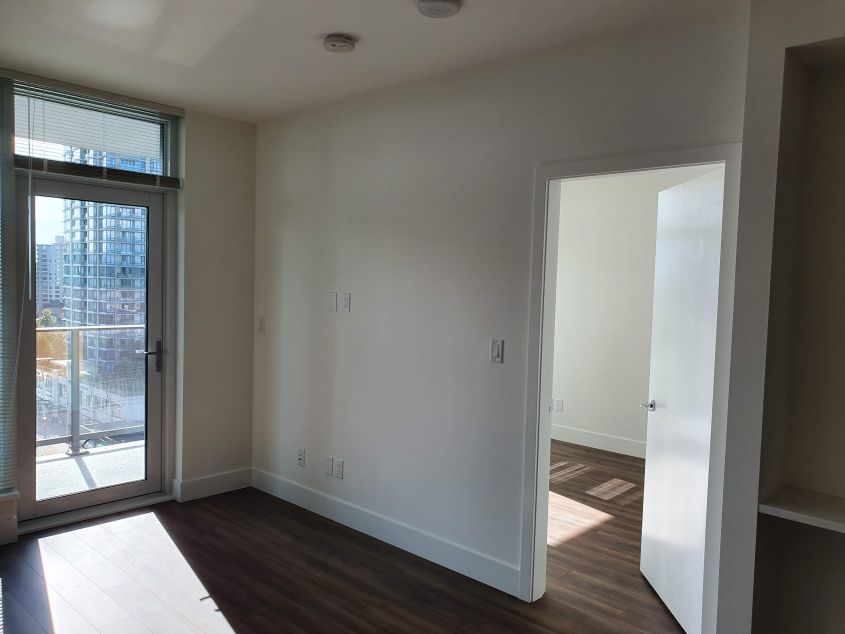
You are a GUI agent. You are given a task and a screenshot of the screen. Output one action in this format:
    pyautogui.click(x=<x>, y=<y>)
    Task: Click on the walls
    This screenshot has height=634, width=845.
    Given the screenshot: What is the action you would take?
    point(384,306), point(211,302), point(596,309), point(791,343)